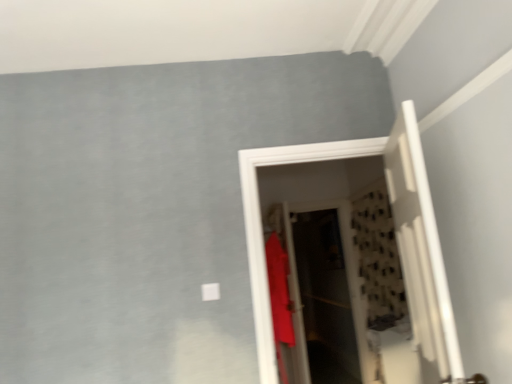
Where is `translucent plastic screen door at center`? translucent plastic screen door at center is located at coordinates (322, 297).

What is the approximate width of matte white door at center, marked as the first door in a back-to-front arrangement?

matte white door at center, marked as the first door in a back-to-front arrangement, is 6.39 inches in width.

Locate an element on the screen. The height and width of the screenshot is (384, 512). matte white door at center, the second door positioned from the front is located at coordinates coord(396,236).

Where is `matte red shirt at center`? The image size is (512, 384). matte red shirt at center is located at coordinates (279, 299).

In order to click on white wooden door at right, the 2th door viewed from the back in this screenshot , I will do `click(422, 255)`.

This screenshot has width=512, height=384. What are the coordinates of `translucent plastic screen door at center` in the screenshot? It's located at (322, 297).

Is matte red shirt at center facing towards white wooden door at right, positioned as the first door in front-to-back order?

No, matte red shirt at center is not facing towards white wooden door at right, positioned as the first door in front-to-back order.

Which is more to the right, matte red shirt at center or white wooden door at right, the 2th door viewed from the back?

white wooden door at right, the 2th door viewed from the back.

Does matte red shirt at center have a lesser height compared to white wooden door at right, the 2th door viewed from the back?

No.

You are a GUI agent. You are given a task and a screenshot of the screen. Output one action in this format:
    pyautogui.click(x=<x>, y=<y>)
    Task: Click on the clothing on the left side of white wooden door at right, the 2th door viewed from the back
    
    Given the screenshot: What is the action you would take?
    pyautogui.click(x=279, y=299)

Is white wooden door at right, the 2th door viewed from the back, further to the viewer compared to translucent plastic screen door at center?

No, white wooden door at right, the 2th door viewed from the back, is closer to the camera.

The width and height of the screenshot is (512, 384). I want to click on screen door located underneath the white wooden door at right, positioned as the first door in front-to-back order (from a real-world perspective), so click(322, 297).

How much distance is there between white wooden door at right, the 2th door viewed from the back, and translucent plastic screen door at center?

A distance of 2.44 meters exists between white wooden door at right, the 2th door viewed from the back, and translucent plastic screen door at center.

Could you tell me if white wooden door at right, the 2th door viewed from the back, is turned towards translucent plastic screen door at center?

No.

From the picture: Would you say matte red shirt at center is outside matte white door at center, marked as the first door in a back-to-front arrangement?

That's correct, matte red shirt at center is outside of matte white door at center, marked as the first door in a back-to-front arrangement.

How many degrees apart are the facing directions of matte red shirt at center and matte white door at center, the second door positioned from the front?

91.2 degrees.

Which is more to the left, matte red shirt at center or matte white door at center, marked as the first door in a back-to-front arrangement?

matte red shirt at center.

Is matte white door at center, marked as the first door in a back-to-front arrangement, taller than translucent plastic screen door at center?

No.

I want to click on the 1st door positioned above the translucent plastic screen door at center (from the image's perspective), so click(396, 236).

Considering the relative positions of matte white door at center, the second door positioned from the front, and translucent plastic screen door at center in the image provided, is matte white door at center, the second door positioned from the front, to the left or to the right of translucent plastic screen door at center?

matte white door at center, the second door positioned from the front, is positioned on translucent plastic screen door at center's left side.

Can you tell me how much matte red shirt at center and translucent plastic screen door at center differ in facing direction?

The angular difference between matte red shirt at center and translucent plastic screen door at center is 91.1 degrees.

Which is further, [287,320] or [305,286]?

The point [305,286] is farther.

Considering the relative positions of matte red shirt at center and translucent plastic screen door at center in the image provided, is matte red shirt at center to the left or to the right of translucent plastic screen door at center?

matte red shirt at center is positioned on translucent plastic screen door at center's left side.

From their relative heights in the image, would you say matte red shirt at center is taller or shorter than translucent plastic screen door at center?

Clearly, matte red shirt at center is shorter compared to translucent plastic screen door at center.

Based on the photo, is translucent plastic screen door at center thinner than matte red shirt at center?

Yes.

Is translucent plastic screen door at center positioned far away from matte red shirt at center?

Yes, translucent plastic screen door at center and matte red shirt at center are located far from each other.

In the scene shown: How far apart are translucent plastic screen door at center and matte red shirt at center?

translucent plastic screen door at center is 1.26 meters away from matte red shirt at center.

Does translucent plastic screen door at center appear on the left side of matte red shirt at center?

In fact, translucent plastic screen door at center is to the right of matte red shirt at center.

Identify the location of door that appears above the white wooden door at right, positioned as the first door in front-to-back order (from a real-world perspective). This screenshot has width=512, height=384. (396, 236).

Is matte white door at center, the second door positioned from the front, located within white wooden door at right, positioned as the first door in front-to-back order?

No, matte white door at center, the second door positioned from the front, is not surrounded by white wooden door at right, positioned as the first door in front-to-back order.

Based on their positions, is white wooden door at right, the 2th door viewed from the back, located to the left or right of matte white door at center, marked as the first door in a back-to-front arrangement?

Clearly, white wooden door at right, the 2th door viewed from the back, is on the right of matte white door at center, marked as the first door in a back-to-front arrangement, in the image.

Considering the relative positions of white wooden door at right, the 2th door viewed from the back, and matte white door at center, marked as the first door in a back-to-front arrangement, in the image provided, is white wooden door at right, the 2th door viewed from the back, in front of matte white door at center, marked as the first door in a back-to-front arrangement,?

Yes, it is.

Where is `clothing on the left of white wooden door at right, positioned as the first door in front-to-back order`? Image resolution: width=512 pixels, height=384 pixels. clothing on the left of white wooden door at right, positioned as the first door in front-to-back order is located at coordinates (279, 299).

The image size is (512, 384). I want to click on screen door on the right of white wooden door at right, positioned as the first door in front-to-back order, so click(x=322, y=297).

Considering their positions, is matte white door at center, the second door positioned from the front, positioned further to translucent plastic screen door at center than white wooden door at right, the 2th door viewed from the back?

matte white door at center, the second door positioned from the front.

Estimate the real-world distances between objects in this image. Which object is closer to matte red shirt at center, matte white door at center, marked as the first door in a back-to-front arrangement, or white wooden door at right, positioned as the first door in front-to-back order?

The object closer to matte red shirt at center is matte white door at center, marked as the first door in a back-to-front arrangement.

When comparing their distances from translucent plastic screen door at center, does matte red shirt at center or matte white door at center, the second door positioned from the front, seem further?

Among the two, matte white door at center, the second door positioned from the front, is located further to translucent plastic screen door at center.

From the image, which object appears to be farther from matte white door at center, the second door positioned from the front, matte red shirt at center or white wooden door at right, positioned as the first door in front-to-back order?

matte red shirt at center lies further to matte white door at center, the second door positioned from the front, than the other object.

Considering their positions, is matte white door at center, marked as the first door in a back-to-front arrangement, positioned closer to matte red shirt at center than translucent plastic screen door at center?

The object closer to matte red shirt at center is translucent plastic screen door at center.

In the scene shown: When comparing their distances from matte white door at center, the second door positioned from the front, does translucent plastic screen door at center or matte red shirt at center seem closer?

matte red shirt at center is closer to matte white door at center, the second door positioned from the front.

When comparing their distances from matte white door at center, the second door positioned from the front, does matte red shirt at center or translucent plastic screen door at center seem closer?

matte red shirt at center.

Considering their positions, is white wooden door at right, positioned as the first door in front-to-back order, positioned closer to matte white door at center, the second door positioned from the front, than translucent plastic screen door at center?

white wooden door at right, positioned as the first door in front-to-back order, is closer to matte white door at center, the second door positioned from the front.

Find the location of a particular element. The height and width of the screenshot is (384, 512). door located between white wooden door at right, positioned as the first door in front-to-back order, and translucent plastic screen door at center in the depth direction is located at coordinates (396, 236).

The width and height of the screenshot is (512, 384). Identify the location of clothing located between matte white door at center, marked as the first door in a back-to-front arrangement, and translucent plastic screen door at center in the depth direction. (279, 299).

At what (x,y) coordinates should I click in order to perform the action: click on clothing between white wooden door at right, positioned as the first door in front-to-back order, and translucent plastic screen door at center, along the z-axis. Please return your answer as a coordinate pair (x, y). The height and width of the screenshot is (384, 512). Looking at the image, I should click on (279, 299).

Where is `door located between white wooden door at right, positioned as the first door in front-to-back order, and matte red shirt at center in the depth direction`? This screenshot has width=512, height=384. door located between white wooden door at right, positioned as the first door in front-to-back order, and matte red shirt at center in the depth direction is located at coordinates (396, 236).